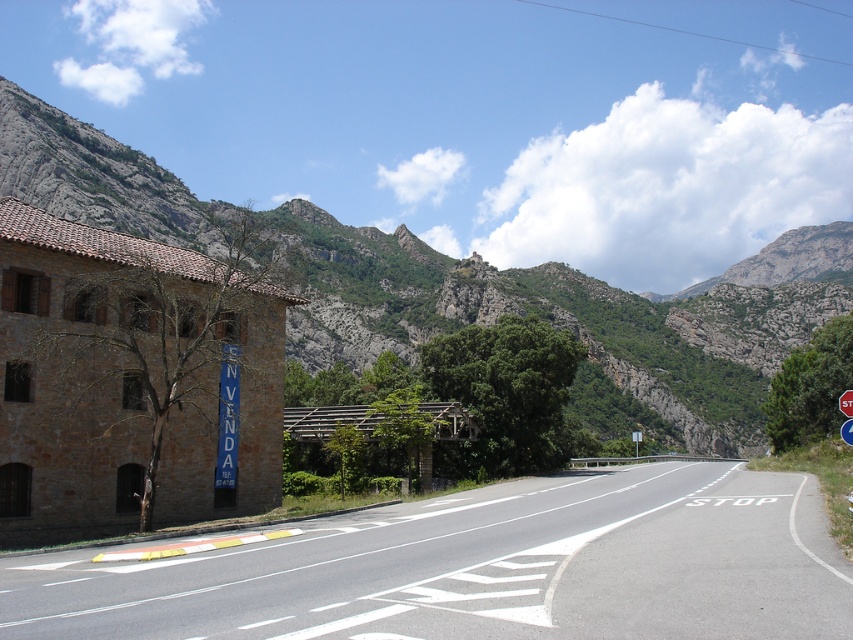
You are standing on the side of the road and want to cross the asphalt road at center. The road is 11.22 meters wide. If your walking speed is 1.5 meters per second, how many seconds will it take you to cross the road safely?

The asphalt road at center is 11.22 meters wide. At a walking speed of 1.5 meters per second, it will take approximately 7.48 seconds to cross safely.

You are driving a car and see the asphalt road at center and the metallic blue stop sign at right. Which object is positioned to the left of the other?

The asphalt road at center is to the left of metallic blue stop sign at right.

You are driving a car and want to take a photo of the rugged stone mountain at upper center. Can you see it clearly through the windshield while staying on the asphalt road at center?

Yes, the asphalt road at center is in front of rugged stone mountain at upper center, so you can see it clearly through the windshield while staying on the asphalt road at center.